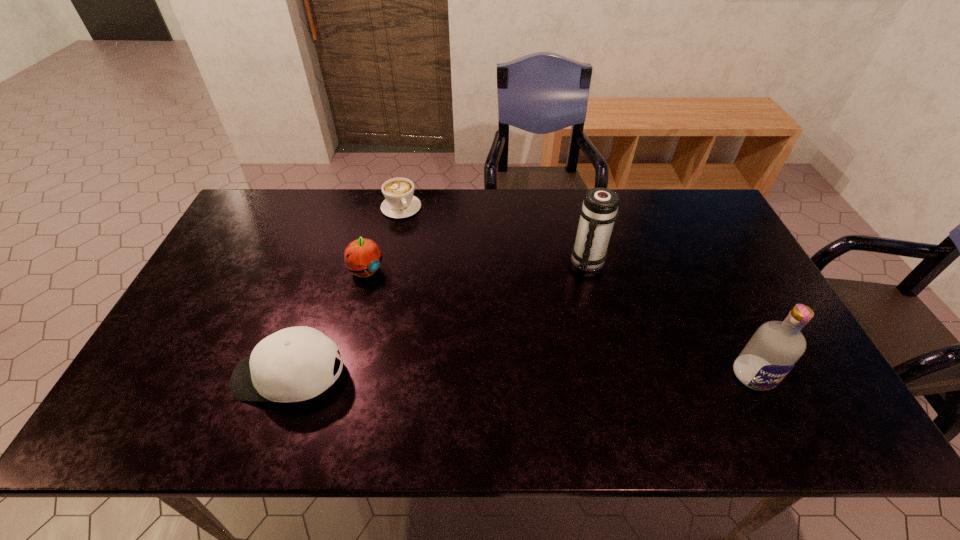
At what (x,y) coordinates should I click in order to perform the action: click on free space that is in between the baseball cap and the rightmost object. Please return your answer as a coordinate pair (x, y). Image resolution: width=960 pixels, height=540 pixels. Looking at the image, I should click on (521, 375).

Where is `blank region between the apple and the thermos bottle`? The image size is (960, 540). blank region between the apple and the thermos bottle is located at coordinates (477, 266).

The height and width of the screenshot is (540, 960). Identify the location of free space between the farthest object and the rightmost object. (x=577, y=292).

Where is `free space between the baseball cap and the rightmost object`? This screenshot has height=540, width=960. free space between the baseball cap and the rightmost object is located at coordinates click(521, 375).

Where is `free space between the second object from right to left and the apple`? free space between the second object from right to left and the apple is located at coordinates (477, 266).

Image resolution: width=960 pixels, height=540 pixels. Find the location of `vacant space in between the apple and the fourth object from left to right`. vacant space in between the apple and the fourth object from left to right is located at coordinates [x=477, y=266].

Where is `free spot between the thermos bottle and the baseball cap`? The height and width of the screenshot is (540, 960). free spot between the thermos bottle and the baseball cap is located at coordinates (439, 319).

Identify the location of free point between the shortest object and the rightmost object. (577, 292).

Identify the location of empty space that is in between the baseball cap and the vodka. The height and width of the screenshot is (540, 960). (521, 375).

You are a GUI agent. You are given a task and a screenshot of the screen. Output one action in this format:
    pyautogui.click(x=<x>, y=<y>)
    Task: Click on the object that is the fourth closest to the vodka
    The image size is (960, 540).
    Given the screenshot: What is the action you would take?
    (x=399, y=202)